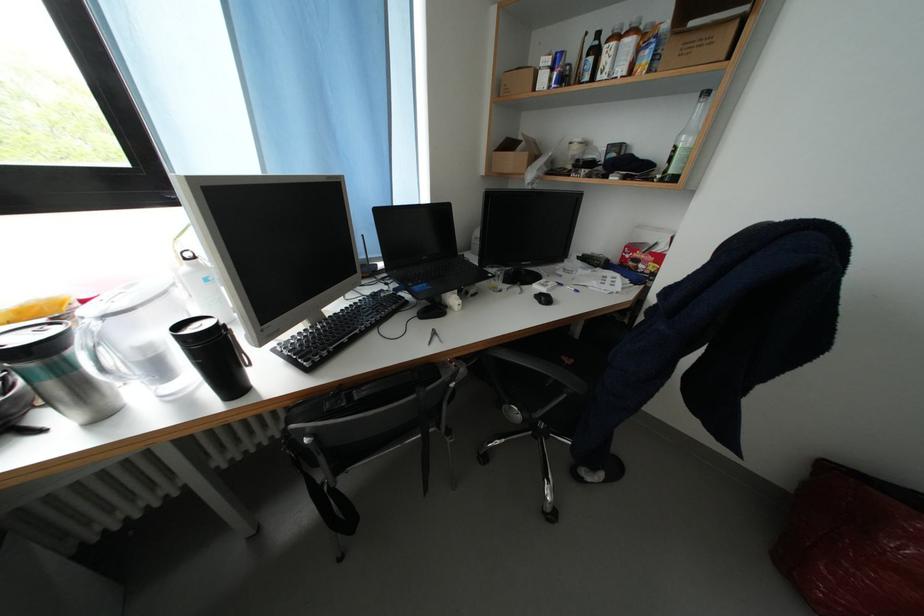
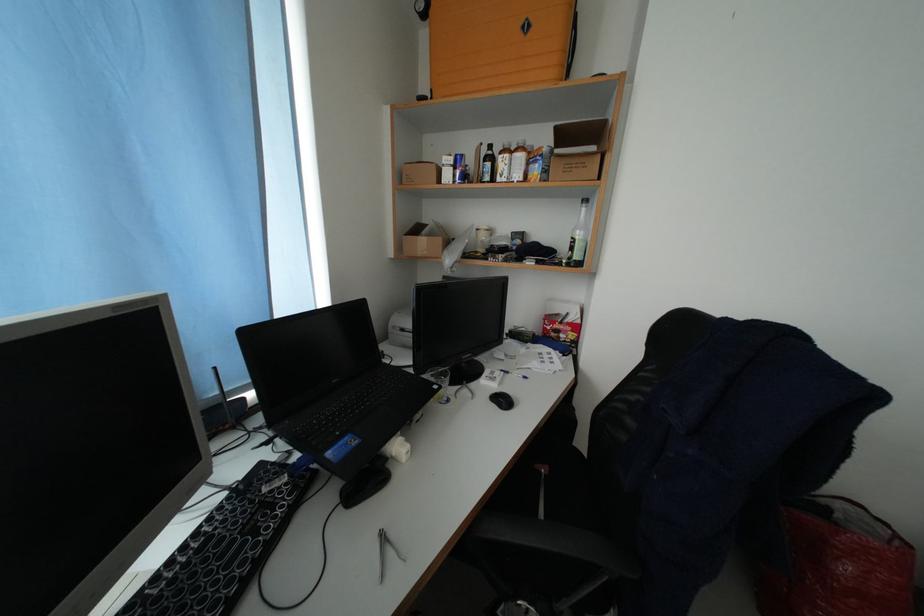
What movement of the cameraman would produce the second image?

The cameraman moved toward left, forward.